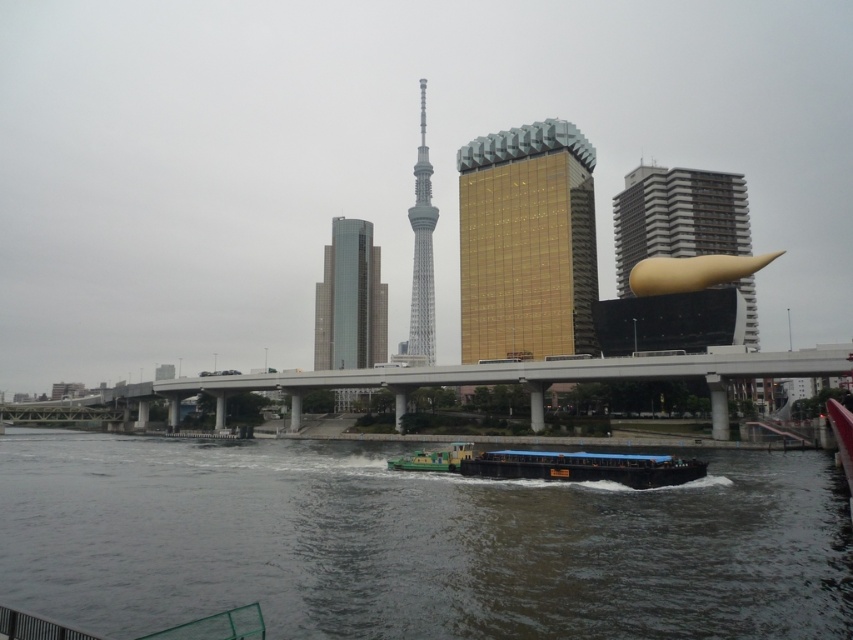
You are a photographer standing on the ferry with a blue roof. You want to capture a photo of the gold metallic sculpture at right and the green matte barge at center in the same frame. Based on their widths, will the sculpture appear wider than the barge in the photo?

The gold metallic sculpture at right might be wider than the green matte barge at center, so it is possible that the sculpture will appear wider in the photo depending on their actual sizes and distances from the camera.

You are a city planner analyzing the urban waterfront scene. You need to determine which object takes up more visual space in the image between the dark blue wooden barge at center and the sleek silver tower at center. Based on the scene description, which one occupies more area?

The sleek silver tower at center occupies more visual space than the dark blue wooden barge at center, as stated in the objects description that the barge occupies less space than the tower.